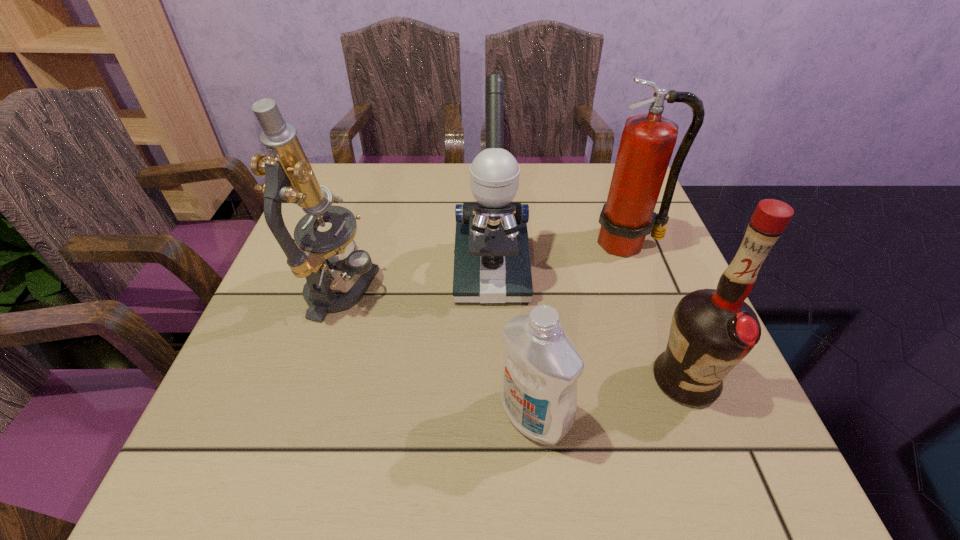
Find the location of `free location that satisfies the following two spatial constraints: 1. at the eyepiece of the right microscope; 2. on the left side of the detergent`. free location that satisfies the following two spatial constraints: 1. at the eyepiece of the right microscope; 2. on the left side of the detergent is located at coordinates 494,416.

Image resolution: width=960 pixels, height=540 pixels. Find the location of `vacant space that satisfies the following two spatial constraints: 1. on the front side of the leftmost object; 2. on the left side of the detergent`. vacant space that satisfies the following two spatial constraints: 1. on the front side of the leftmost object; 2. on the left side of the detergent is located at coordinates (302, 416).

The height and width of the screenshot is (540, 960). Identify the location of vacant space that satisfies the following two spatial constraints: 1. at the eyepiece of the right microscope; 2. on the left side of the detergent. (494, 416).